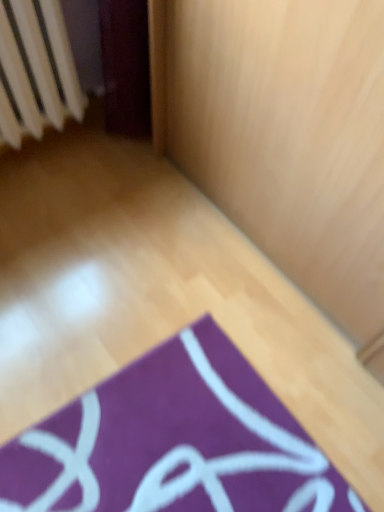
Question: Is white plastic radiator at upper left shorter than purple fabric yoga mat at lower center?

Choices:
 (A) yes
 (B) no

Answer: (B)

Question: From a real-world perspective, is white plastic radiator at upper left on top of purple fabric yoga mat at lower center?

Choices:
 (A) no
 (B) yes

Answer: (B)

Question: Would you consider white plastic radiator at upper left to be distant from purple fabric yoga mat at lower center?

Choices:
 (A) yes
 (B) no

Answer: (A)

Question: Does white plastic radiator at upper left have a smaller size compared to purple fabric yoga mat at lower center?

Choices:
 (A) no
 (B) yes

Answer: (A)

Question: Is white plastic radiator at upper left located outside purple fabric yoga mat at lower center?

Choices:
 (A) no
 (B) yes

Answer: (B)

Question: Is white plastic radiator at upper left next to purple fabric yoga mat at lower center?

Choices:
 (A) no
 (B) yes

Answer: (A)

Question: Considering the relative positions of purple fabric yoga mat at lower center and white plastic radiator at upper left in the image provided, is purple fabric yoga mat at lower center to the left of white plastic radiator at upper left from the viewer's perspective?

Choices:
 (A) no
 (B) yes

Answer: (A)

Question: From a real-world perspective, is purple fabric yoga mat at lower center below white plastic radiator at upper left?

Choices:
 (A) no
 (B) yes

Answer: (B)

Question: From a real-world perspective, is purple fabric yoga mat at lower center on top of white plastic radiator at upper left?

Choices:
 (A) no
 (B) yes

Answer: (A)

Question: From the image's perspective, would you say purple fabric yoga mat at lower center is positioned over white plastic radiator at upper left?

Choices:
 (A) yes
 (B) no

Answer: (B)

Question: Considering the relative sizes of purple fabric yoga mat at lower center and white plastic radiator at upper left in the image provided, is purple fabric yoga mat at lower center smaller than white plastic radiator at upper left?

Choices:
 (A) yes
 (B) no

Answer: (A)

Question: Considering the relative positions of purple fabric yoga mat at lower center and white plastic radiator at upper left in the image provided, is purple fabric yoga mat at lower center to the right of white plastic radiator at upper left from the viewer's perspective?

Choices:
 (A) no
 (B) yes

Answer: (B)

Question: In terms of height, does white plastic radiator at upper left look taller or shorter compared to purple fabric yoga mat at lower center?

Choices:
 (A) short
 (B) tall

Answer: (B)